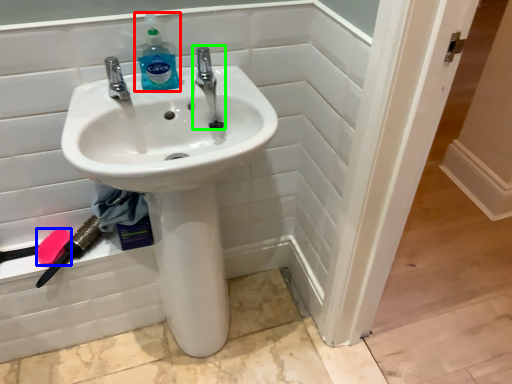
Question: Which is nearer to the cleaning product (highlighted by a red box)? soap (highlighted by a blue box) or tap (highlighted by a green box).

Choices:
 (A) soap
 (B) tap

Answer: (B)